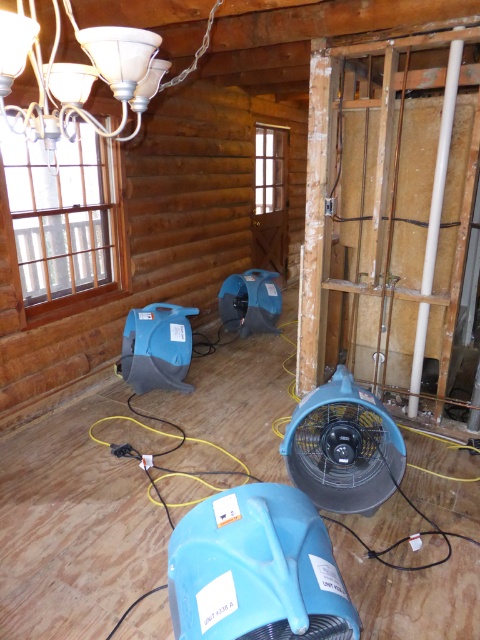
You are standing inside the log cabin and want to hang a decoration from the ceiling. You have two options available to choose from. One is the white frosted glass chandelier at upper left, and the other is the blue plastic fan at center. Which object is positioned closer to the ceiling where you can easily reach it?

The white frosted glass chandelier at upper left is closer to the viewer than the blue plastic fan at center, so the chandelier is positioned closer to the ceiling and can be easily reached.

You are an interior designer assessing the log cabin. You need to install a new light fixture that requires a minimum of 2 meters of clearance from the floor. Based on the current setup, can the white frosted glass chandelier at upper left and the blue plastic fan at center both be safely installed without violating the clearance requirement?

The white frosted glass chandelier at upper left has a lesser height compared to the blue plastic fan at center. Since the chandelier is lower, if it meets the 2 meters clearance, the fan, being taller, would also likely satisfy the requirement. However, if the chandelier is below 2 meters, neither would comply.

You are a contractor working in the log cabin and need to install a new light fixture. You have a ladder that is 1.5 meters long. The white frosted glass chandelier at upper left is where you need to work. Can you safely reach it from the blue plastic fan at center with your ladder?

The distance between the white frosted glass chandelier at upper left and the blue plastic fan at center is 1.62 meters. Since the ladder is only 1.5 meters long, it is not long enough to safely reach the chandelier from the fan.